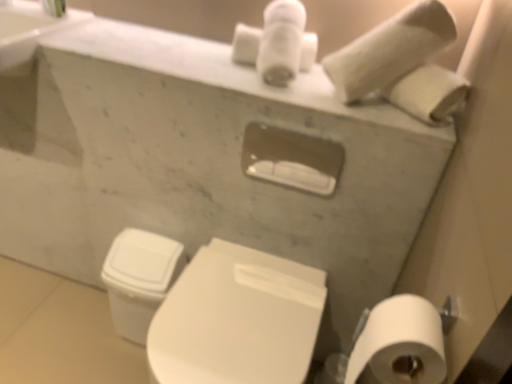
Question: Is white glossy toilet at lower center touching white matte toilet paper at lower right, the 1th toilet paper positioned from the bottom?

Choices:
 (A) yes
 (B) no

Answer: (B)

Question: Does white glossy toilet at lower center come in front of white matte toilet paper at lower right, positioned as the 2th toilet paper in top-to-bottom order?

Choices:
 (A) no
 (B) yes

Answer: (A)

Question: Is white glossy toilet at lower center to the left of white matte toilet paper at lower right, positioned as the first toilet paper in front-to-back order, from the viewer's perspective?

Choices:
 (A) yes
 (B) no

Answer: (A)

Question: Considering the relative sizes of white glossy toilet at lower center and white matte toilet paper at lower right, positioned as the first toilet paper in front-to-back order, in the image provided, is white glossy toilet at lower center smaller than white matte toilet paper at lower right, positioned as the first toilet paper in front-to-back order,?

Choices:
 (A) no
 (B) yes

Answer: (A)

Question: Is white glossy toilet at lower center outside of white matte toilet paper at lower right, positioned as the 2th toilet paper in back-to-front order?

Choices:
 (A) no
 (B) yes

Answer: (B)

Question: Considering the relative sizes of white glossy toilet at lower center and white matte toilet paper at lower right, positioned as the 2th toilet paper in top-to-bottom order, in the image provided, is white glossy toilet at lower center taller than white matte toilet paper at lower right, positioned as the 2th toilet paper in top-to-bottom order,?

Choices:
 (A) no
 (B) yes

Answer: (B)

Question: From the image's perspective, is white matte toilet paper at upper right, marked as the 1th toilet paper in a back-to-front arrangement, over white matte toilet paper at lower right, positioned as the 2th toilet paper in back-to-front order?

Choices:
 (A) yes
 (B) no

Answer: (A)

Question: Is white matte toilet paper at lower right, positioned as the first toilet paper in front-to-back order, a part of white matte toilet paper at upper right, which is the 2th toilet paper from front to back?

Choices:
 (A) yes
 (B) no

Answer: (B)

Question: From a real-world perspective, does white matte toilet paper at upper right, which ranks as the second toilet paper in bottom-to-top order, stand above white matte toilet paper at lower right, positioned as the first toilet paper in front-to-back order?

Choices:
 (A) yes
 (B) no

Answer: (A)

Question: Is white matte toilet paper at upper right, which is the 2th toilet paper from front to back, thinner than white matte toilet paper at lower right, the 1th toilet paper positioned from the bottom?

Choices:
 (A) no
 (B) yes

Answer: (A)

Question: Considering the relative sizes of white matte toilet paper at upper right, marked as the 1th toilet paper in a back-to-front arrangement, and white matte toilet paper at lower right, positioned as the first toilet paper in front-to-back order, in the image provided, is white matte toilet paper at upper right, marked as the 1th toilet paper in a back-to-front arrangement, smaller than white matte toilet paper at lower right, positioned as the first toilet paper in front-to-back order,?

Choices:
 (A) no
 (B) yes

Answer: (A)

Question: Are white matte toilet paper at upper right, which is the 2th toilet paper from front to back, and white matte toilet paper at lower right, the 1th toilet paper positioned from the bottom, making contact?

Choices:
 (A) yes
 (B) no

Answer: (B)

Question: Does white matte toilet paper at upper right, which is the 2th toilet paper from front to back, appear on the right side of white glossy toilet at lower center?

Choices:
 (A) yes
 (B) no

Answer: (A)